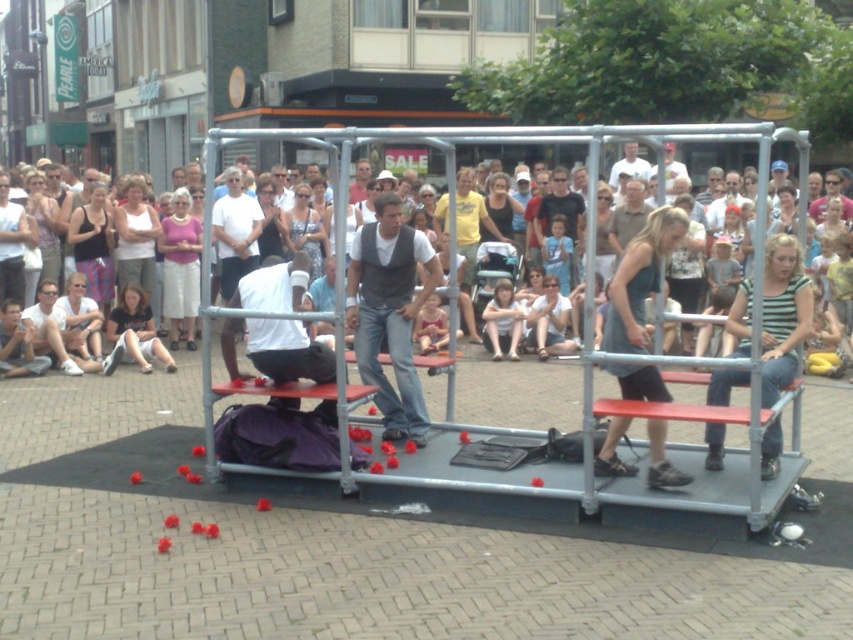
Question: Can you confirm if matte white crowd at center is bigger than matte black tank top at center?

Choices:
 (A) yes
 (B) no

Answer: (B)

Question: Observing the image, what is the correct spatial positioning of matte pink blouse at center in reference to matte gray vest at center?

Choices:
 (A) above
 (B) below

Answer: (B)

Question: Among these points, which one is nearest to the camera?

Choices:
 (A) (123, 248)
 (B) (175, 280)
 (C) (103, 285)
 (D) (279, 381)

Answer: (D)

Question: Considering the real-world distances, which object is farthest from the white matte shirt at center?

Choices:
 (A) matte black tank top at center
 (B) denim jeans at center

Answer: (A)

Question: Which of the following is the closest to the observer?

Choices:
 (A) (639, 172)
 (B) (109, 294)
 (C) (170, 232)
 (D) (146, 289)

Answer: (C)

Question: Is matte white crowd at center further to camera compared to matte pink blouse at center?

Choices:
 (A) yes
 (B) no

Answer: (B)